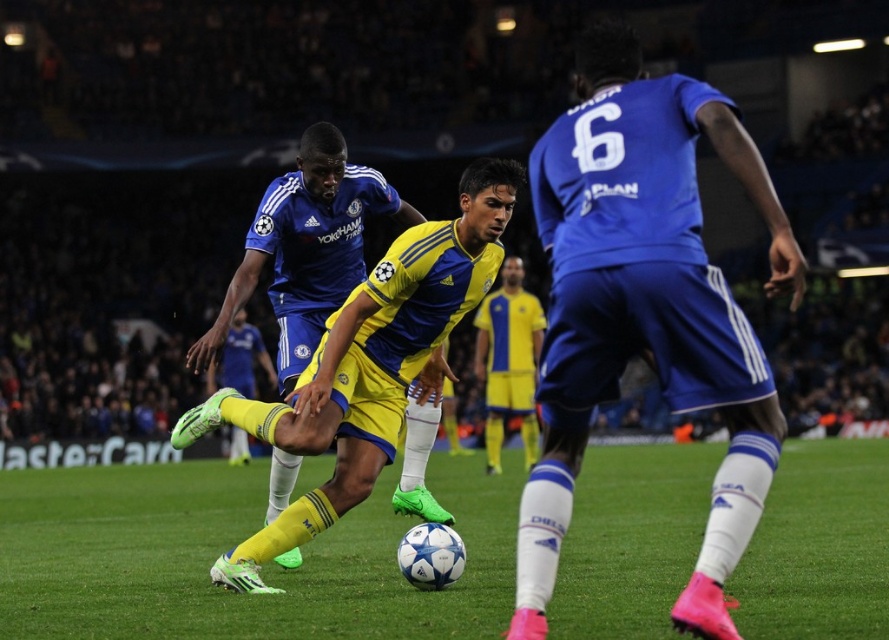
Question: Considering the real-world distances, which object is farthest from the blue jersey at center?

Choices:
 (A) green grass at center
 (B) yellow matte soccer cleat at center

Answer: (B)

Question: Is blue jersey at center in front of yellow jersey at center?

Choices:
 (A) no
 (B) yes

Answer: (B)

Question: Does green grass at center have a smaller size compared to blue jersey at center?

Choices:
 (A) yes
 (B) no

Answer: (B)

Question: Is green grass at center above blue jersey at center?

Choices:
 (A) no
 (B) yes

Answer: (A)

Question: Based on their relative distances, which object is nearer to the blue jersey at center?

Choices:
 (A) blue matte jersey at center
 (B) yellow jersey at center
 (C) yellow matte jersey at center
 (D) yellow matte soccer cleat at center

Answer: (A)

Question: Among these points, which one is farthest from the camera?

Choices:
 (A) (511, 276)
 (B) (129, 525)
 (C) (759, 168)

Answer: (A)